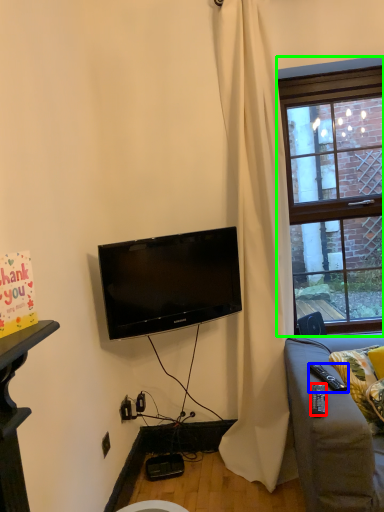
Question: Which object is positioned closest to remote control (highlighted by a red box)? Select from remote control (highlighted by a blue box) and window (highlighted by a green box).

Choices:
 (A) remote control
 (B) window

Answer: (A)